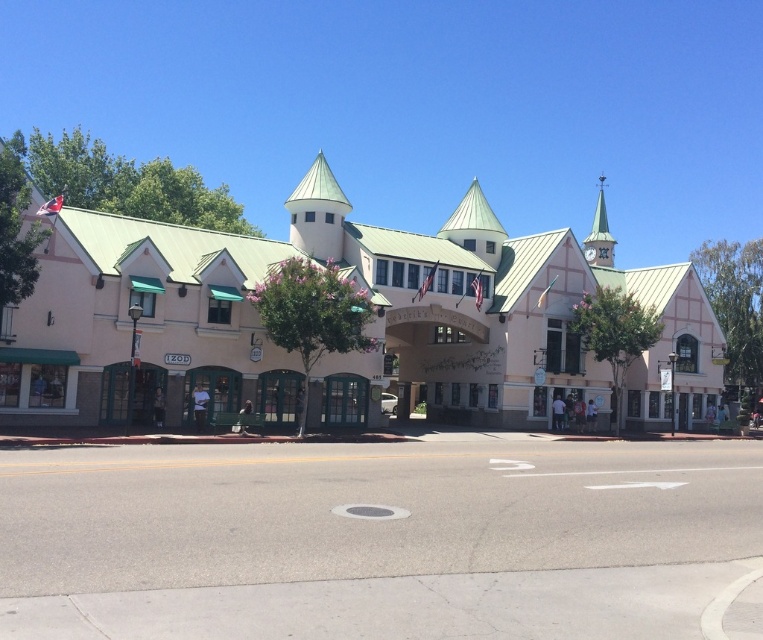
Is point (401, 352) closer to camera compared to point (581, 241)?

Yes, it is.

Image resolution: width=763 pixels, height=640 pixels. In order to click on pink matte building at center in this screenshot , I will do `click(366, 330)`.